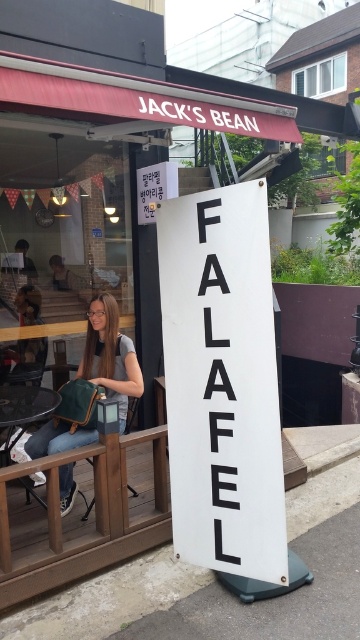
I want to click on white matte sign at center, so click(x=222, y=381).

Which is behind, point (251, 433) or point (83, 362)?

Point (83, 362)

Between point (232, 566) and point (122, 371), which one is positioned in front?

Positioned in front is point (232, 566).

The width and height of the screenshot is (360, 640). Find the location of `white matte sign at center`. white matte sign at center is located at coordinates (222, 381).